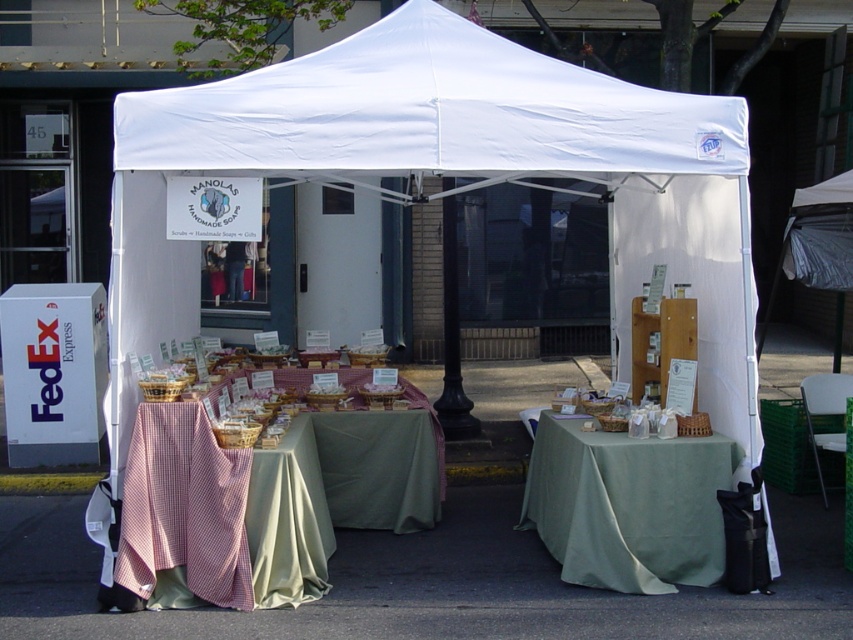
You are setting up a stall at an outdoor market and want to ensure that your canopy provides enough shade for your table. Given the white fabric canopy at upper center and the checkered fabric table at center, which one is bigger in size?

The white fabric canopy at upper center is larger in size than the checkered fabric table at center, so the canopy will provide sufficient shade for the table.

You are a customer at the outdoor market stall. You want to pick up an item from the checkered fabric table at center and then move to the green fabric table at center. Which table should you approach first?

You should approach the checkered fabric table at center first because it is in front of the green fabric table at center, making it closer to you.